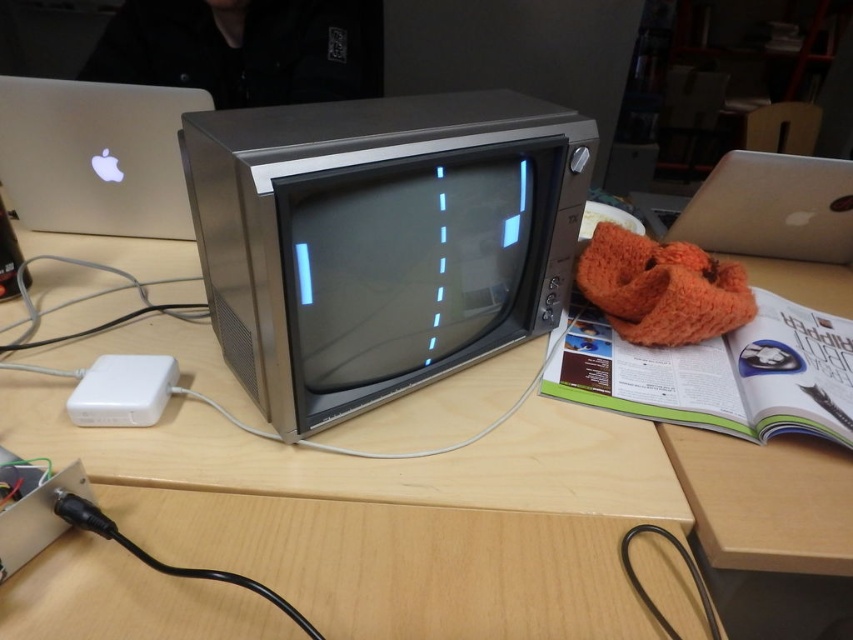
Question: Which of the following is the farthest from the observer?

Choices:
 (A) silver metallic laptop at upper right
 (B) satin silver laptop at left
 (C) metallic wood desk at center

Answer: (A)

Question: Is metallic wood desk at center in front of satin silver laptop at left?

Choices:
 (A) yes
 (B) no

Answer: (A)

Question: Does metallic wood desk at center have a larger size compared to satin silver laptop at left?

Choices:
 (A) no
 (B) yes

Answer: (B)

Question: Which point is farther to the camera?

Choices:
 (A) silver metallic laptop at upper right
 (B) satin silver laptop at left
 (C) metallic wood desk at center

Answer: (A)

Question: Can you confirm if metallic wood desk at center is positioned below satin silver laptop at left?

Choices:
 (A) no
 (B) yes

Answer: (B)

Question: Which point is closer to the camera taking this photo?

Choices:
 (A) (756, 198)
 (B) (248, 547)
 (C) (117, 90)

Answer: (B)